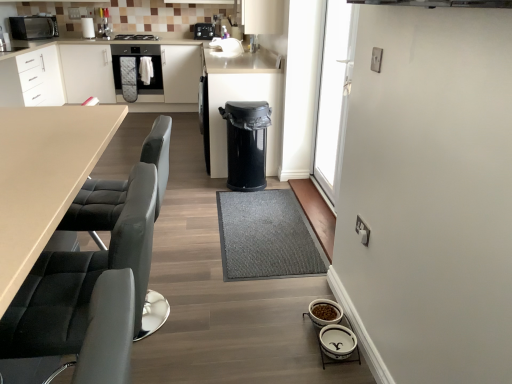
Where is `vacant area that lies in front of transparent glass door at upper right`? vacant area that lies in front of transparent glass door at upper right is located at coordinates (310, 210).